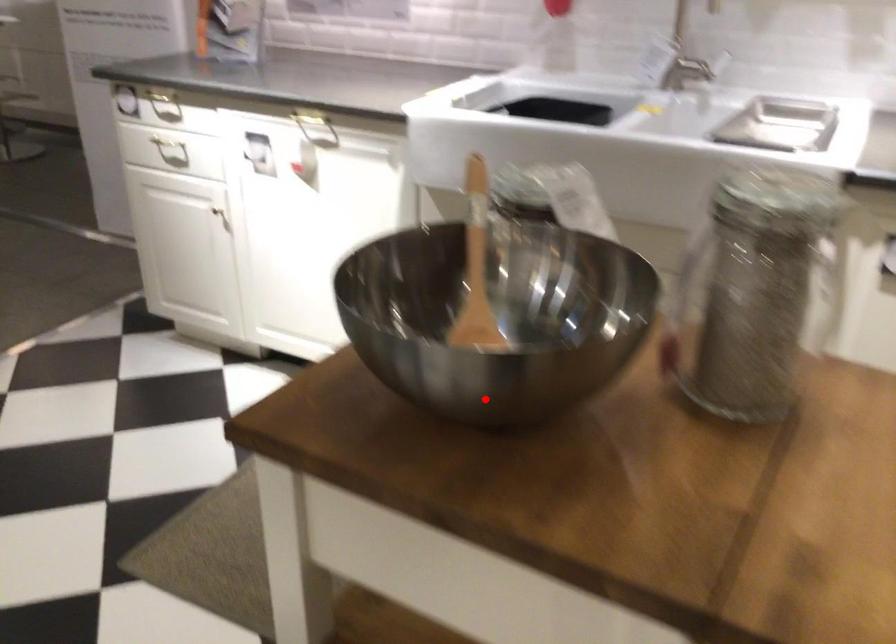
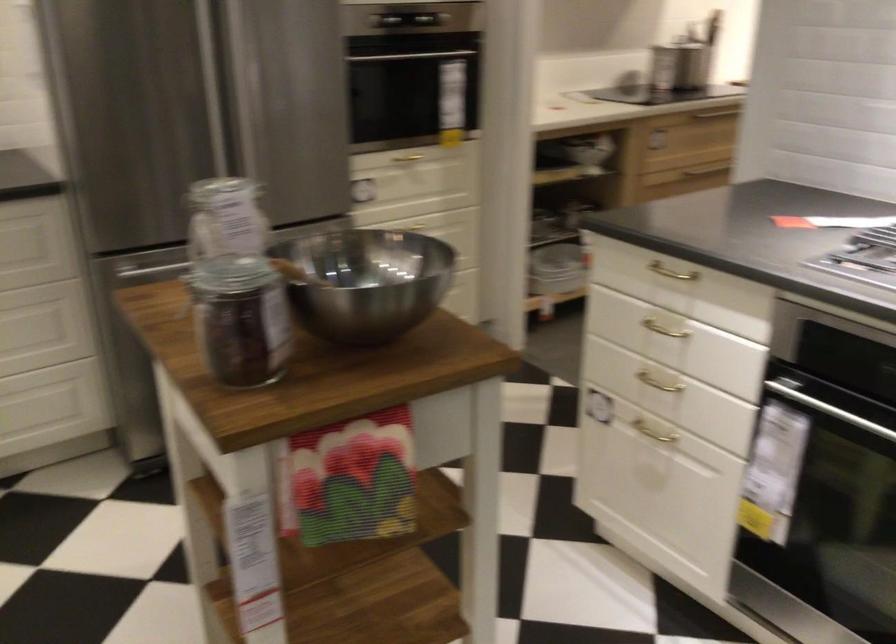
In the second image, find the point that corresponds to the highlighted location in the first image.

(366, 281)